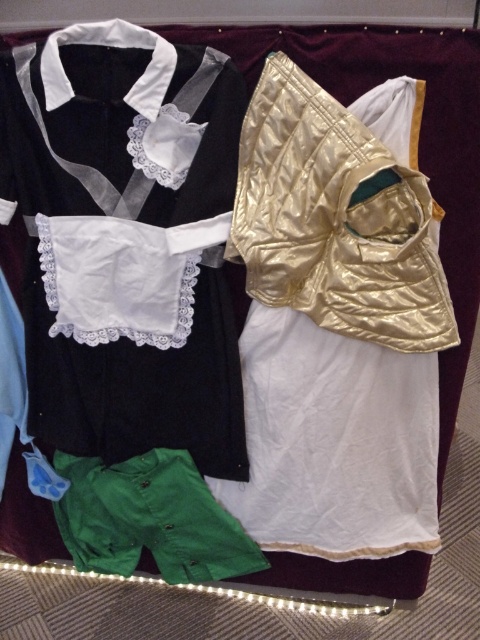
Between black velvet shirt at upper left and gold quilted dress at upper right, which one appears on the right side from the viewer's perspective?

gold quilted dress at upper right

Between black velvet shirt at upper left and gold quilted dress at upper right, which one appears on the left side from the viewer's perspective?

Positioned to the left is black velvet shirt at upper left.

Who is more forward, (196, 384) or (340, 417)?

Point (340, 417)

Find the location of a particular element. black velvet shirt at upper left is located at coordinates (126, 241).

Can you confirm if gold quilted dress at upper right is smaller than green cotton shorts at lower left?

Actually, gold quilted dress at upper right might be larger than green cotton shorts at lower left.

At what (x,y) coordinates should I click in order to perform the action: click on gold quilted dress at upper right. Please return your answer as a coordinate pair (x, y). Looking at the image, I should click on (336, 324).

Find the location of a particular element. Image resolution: width=480 pixels, height=640 pixels. black velvet shirt at upper left is located at coordinates (126, 241).